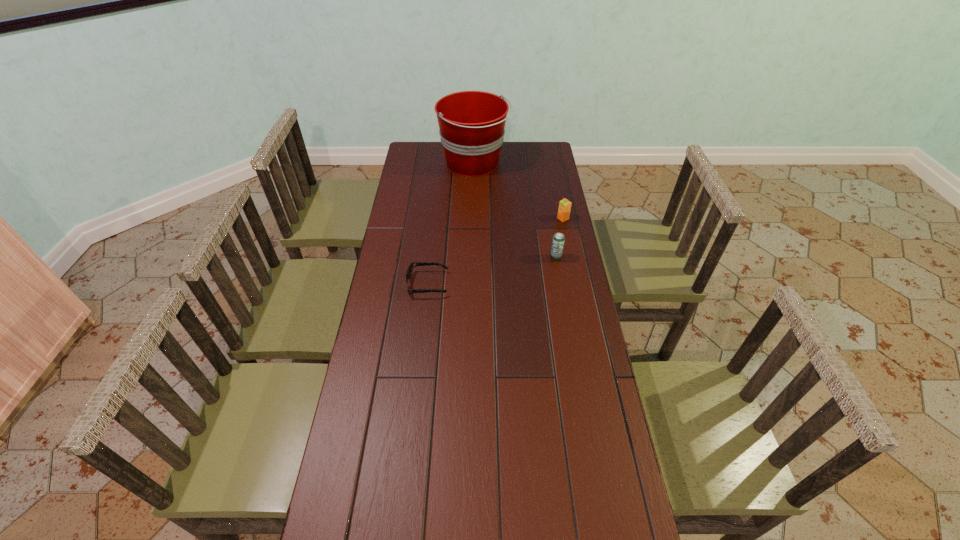
Locate an element on the screen. This screenshot has width=960, height=540. vacant point located between the rightmost object and the sunglasses is located at coordinates (495, 252).

Where is `free area in between the second nearest object and the bucket`? The height and width of the screenshot is (540, 960). free area in between the second nearest object and the bucket is located at coordinates click(515, 211).

The width and height of the screenshot is (960, 540). Find the location of `free spot between the sunglasses and the orange juice`. free spot between the sunglasses and the orange juice is located at coordinates (495, 252).

Image resolution: width=960 pixels, height=540 pixels. Identify the location of vacant space that is in between the bucket and the sunglasses. [x=451, y=224].

This screenshot has height=540, width=960. I want to click on empty space that is in between the farthest object and the nearest object, so click(x=451, y=224).

This screenshot has width=960, height=540. Identify the location of vacant space in between the tallest object and the rightmost object. click(x=518, y=191).

The width and height of the screenshot is (960, 540). In order to click on vacant area between the second farthest object and the shortest object in this screenshot , I will do `click(495, 252)`.

Choose which object is the second nearest neighbor to the tallest object. Please provide its 2D coordinates. Your answer should be formatted as a tuple, i.e. [(x, y)], where the tuple contains the x and y coordinates of a point satisfying the conditions above.

[(558, 240)]

I want to click on object that ranks as the second closest to the third object from left to right, so click(x=409, y=271).

The height and width of the screenshot is (540, 960). I want to click on vacant space that satisfies the following two spatial constraints: 1. on the back side of the second object from right to left; 2. on the right side of the orange juice, so click(x=549, y=219).